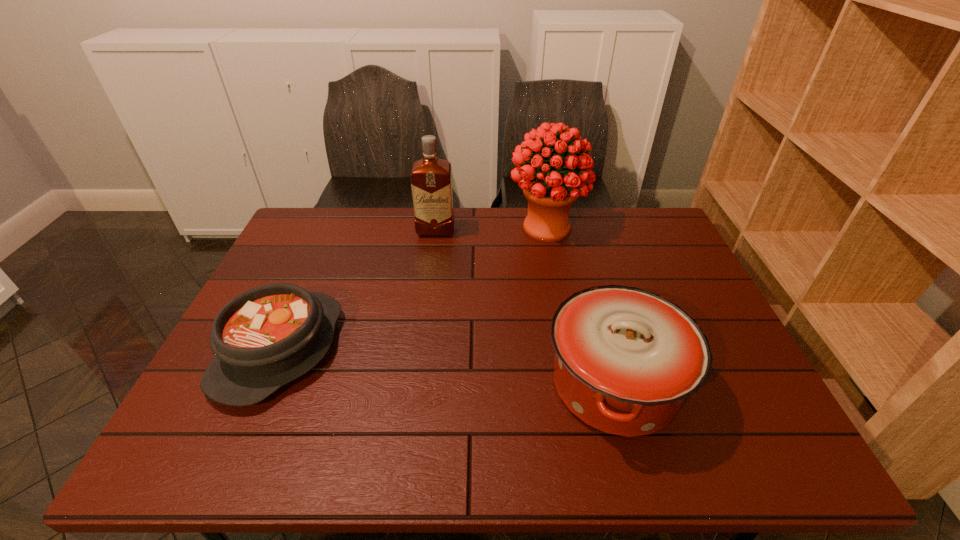
Identify the location of bouquet. The height and width of the screenshot is (540, 960). (550, 194).

Where is `the second object from left to right`? The width and height of the screenshot is (960, 540). the second object from left to right is located at coordinates (431, 178).

This screenshot has width=960, height=540. In order to click on the taller casserole in this screenshot , I will do `click(626, 359)`.

Identify the location of the second shortest object. (626, 359).

At what (x,y) coordinates should I click in order to perform the action: click on the shorter casserole. Please return your answer as a coordinate pair (x, y). Looking at the image, I should click on (264, 338).

The height and width of the screenshot is (540, 960). I want to click on the left casserole, so click(x=264, y=338).

Locate an element on the screen. Image resolution: width=960 pixels, height=540 pixels. free spot located on the left of the bouquet is located at coordinates (449, 227).

The image size is (960, 540). Find the location of `vacant space situated on the front label of the second object from left to right`. vacant space situated on the front label of the second object from left to right is located at coordinates (425, 313).

Image resolution: width=960 pixels, height=540 pixels. In order to click on free spot located on the left of the taller casserole in this screenshot , I will do `click(404, 384)`.

Where is `blank space located on the right of the left casserole`? The width and height of the screenshot is (960, 540). blank space located on the right of the left casserole is located at coordinates (388, 349).